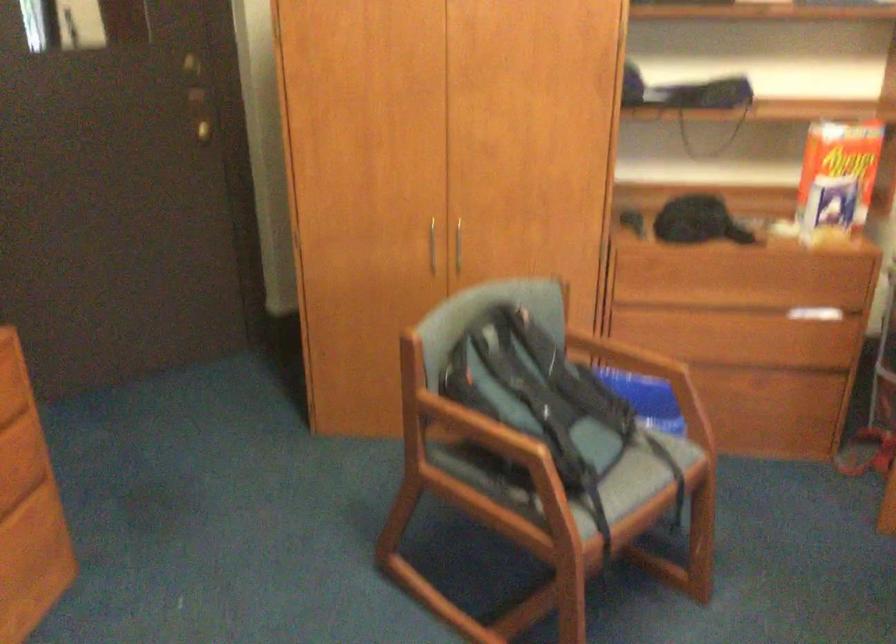
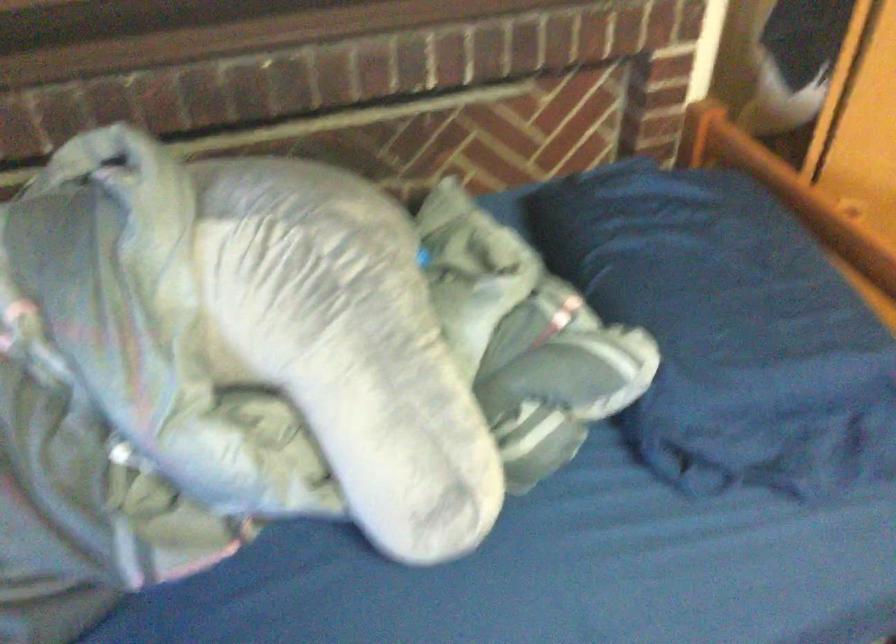
First-person continuous shooting, in which direction is the camera rotating?

The rotation direction of the camera is left-down.